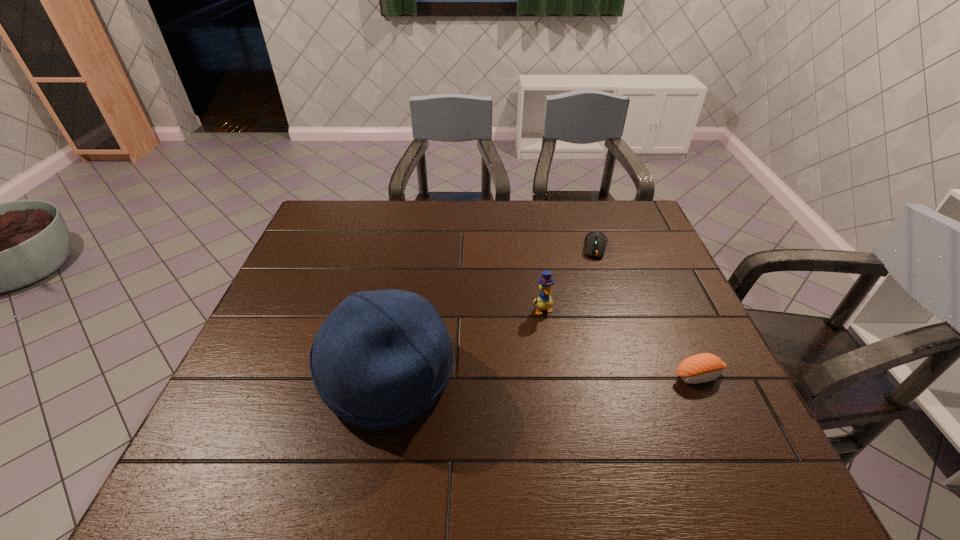
Locate an element on the screen. The width and height of the screenshot is (960, 540). free space on the desktop that is between the tallest object and the second shortest object and is positioned on the face of the duckling, where the monocle is placed is located at coordinates click(x=579, y=376).

Image resolution: width=960 pixels, height=540 pixels. Identify the location of vacant space on the desktop that is between the leftmost object and the sushi and is positioned on the button of the shortest object. (574, 376).